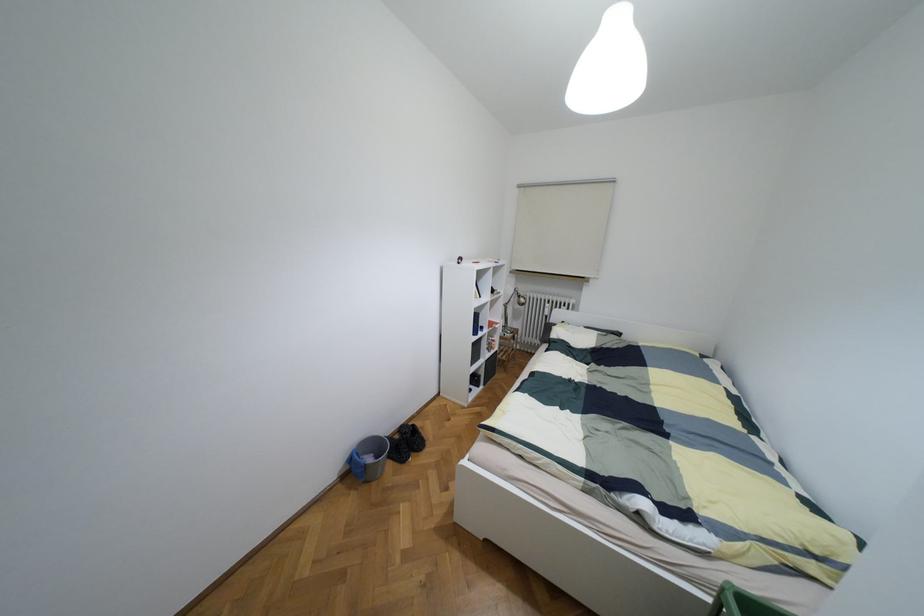
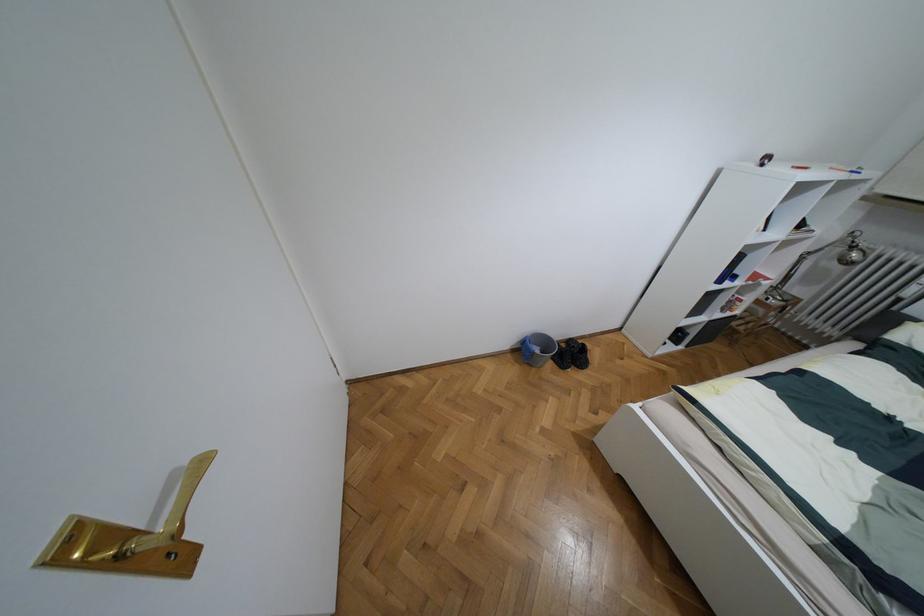
Question: I am providing you with two images of the same scene from different viewpoints. After the viewpoint changes to image2, which objects are now occluded?

Choices:
 (A) gray bucket
 (B) gold door handle
 (C) desk lamp head
 (D) none of these

Answer: (D)